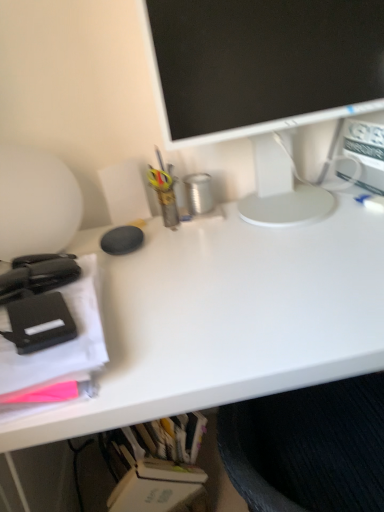
Where is `free space in front of white glossy monitor at upper center`? free space in front of white glossy monitor at upper center is located at coordinates (277, 259).